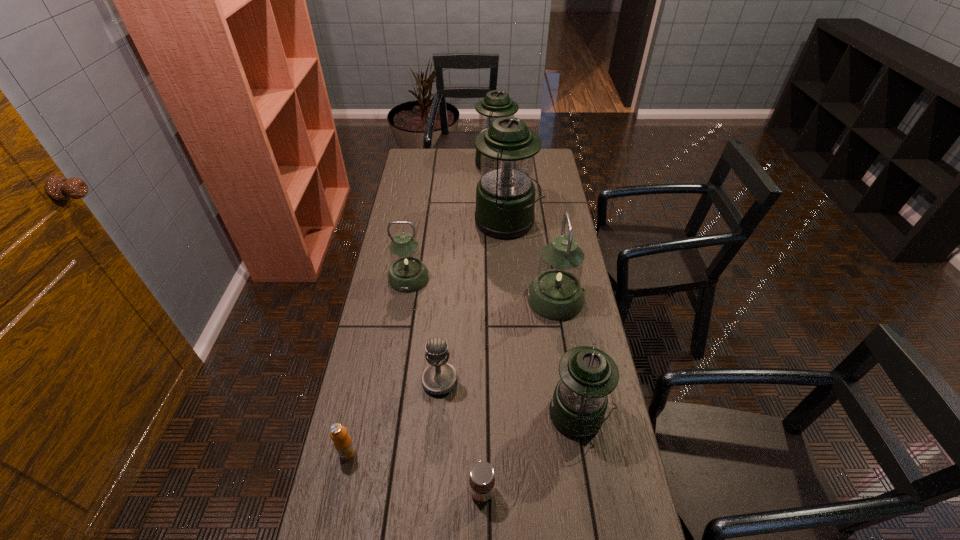
Where is `vacant space at the right edge of the desktop`? vacant space at the right edge of the desktop is located at coordinates (550, 242).

Where is `blank space at the far left corner of the desktop`? blank space at the far left corner of the desktop is located at coordinates (435, 167).

You are a GUI agent. You are given a task and a screenshot of the screen. Output one action in this format:
    pyautogui.click(x=<x>, y=<y>)
    Task: Click on the blank space at the far right corner
    The width and height of the screenshot is (960, 540).
    Given the screenshot: What is the action you would take?
    pyautogui.click(x=550, y=171)

Image resolution: width=960 pixels, height=540 pixels. What are the coordinates of `vacant area that lies between the bigger greenish lantern and the smaller greenish lantern` in the screenshot? It's located at [x=482, y=289].

In order to click on free point between the bigger greenish lantern and the second farthest lantern in this screenshot , I will do `click(532, 261)`.

Where is `free area in between the seventh tallest object and the nearest green lantern`? The width and height of the screenshot is (960, 540). free area in between the seventh tallest object and the nearest green lantern is located at coordinates (463, 434).

Where is `unoccupied position between the second smallest green lantern and the jam`? The image size is (960, 540). unoccupied position between the second smallest green lantern and the jam is located at coordinates (490, 328).

The width and height of the screenshot is (960, 540). Identify the location of unoccupied area between the seventh tallest object and the shortest object. (415, 472).

The width and height of the screenshot is (960, 540). I want to click on empty location between the seventh tallest object and the third shortest object, so pos(394,417).

Image resolution: width=960 pixels, height=540 pixels. I want to click on vacant space that's between the biggest green lantern and the sixth object from right to left, so click(x=473, y=302).